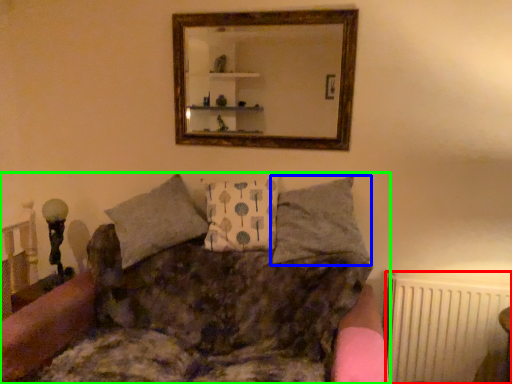
Question: Estimate the real-world distances between objects in this image. Which object is closer to radiator (highlighted by a red box), pillow (highlighted by a blue box) or studio couch (highlighted by a green box)?

Choices:
 (A) pillow
 (B) studio couch

Answer: (A)